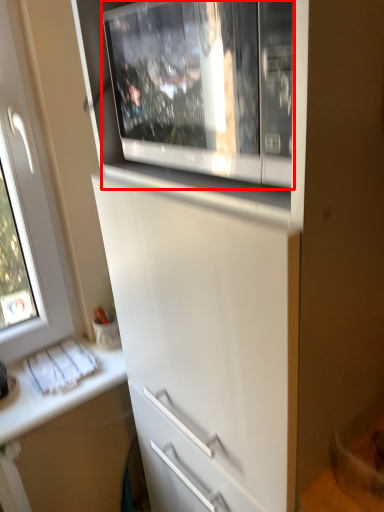
Question: From the image's perspective, considering the relative positions of home appliance (annotated by the red box) and counter top in the image provided, where is home appliance (annotated by the red box) located with respect to the staircase?

Choices:
 (A) below
 (B) above

Answer: (B)